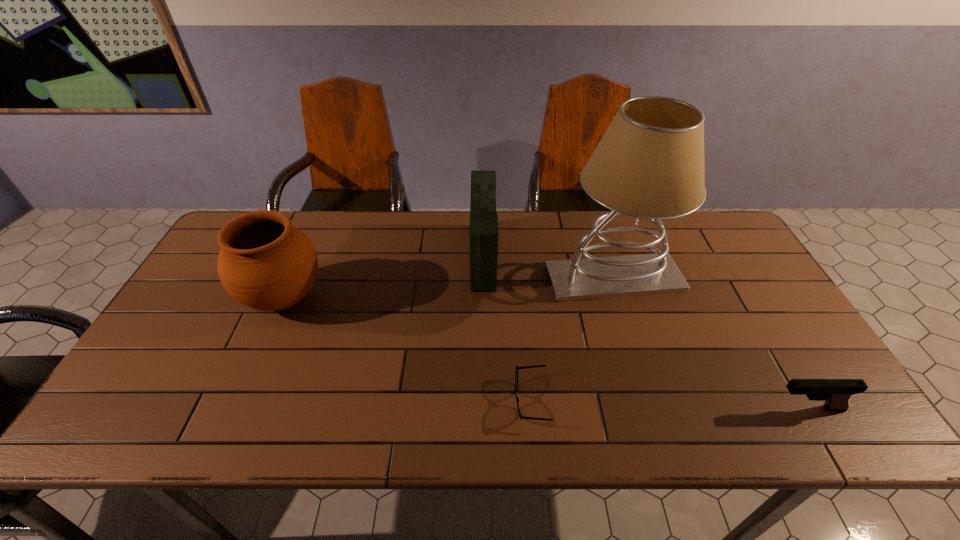
Locate an element on the screen. object that is the third closest to the fourth object from right to left is located at coordinates (265, 263).

I want to click on object that is the closest one to the first-aid kit, so click(649, 164).

This screenshot has height=540, width=960. Identify the location of free space that satisfies the following two spatial constraints: 1. on the front-facing side of the fourth object from right to left; 2. on the back side of the table lamp. (484, 279).

Where is `free point that satisfies the following two spatial constraints: 1. on the front-facing side of the second object from right to left; 2. on the right side of the second object from left to right`? The width and height of the screenshot is (960, 540). free point that satisfies the following two spatial constraints: 1. on the front-facing side of the second object from right to left; 2. on the right side of the second object from left to right is located at coordinates (484, 279).

This screenshot has height=540, width=960. Find the location of `free space that satisfies the following two spatial constraints: 1. on the back side of the second object from right to left; 2. on the front-facing side of the fourth object from right to left`. free space that satisfies the following two spatial constraints: 1. on the back side of the second object from right to left; 2. on the front-facing side of the fourth object from right to left is located at coordinates (608, 256).